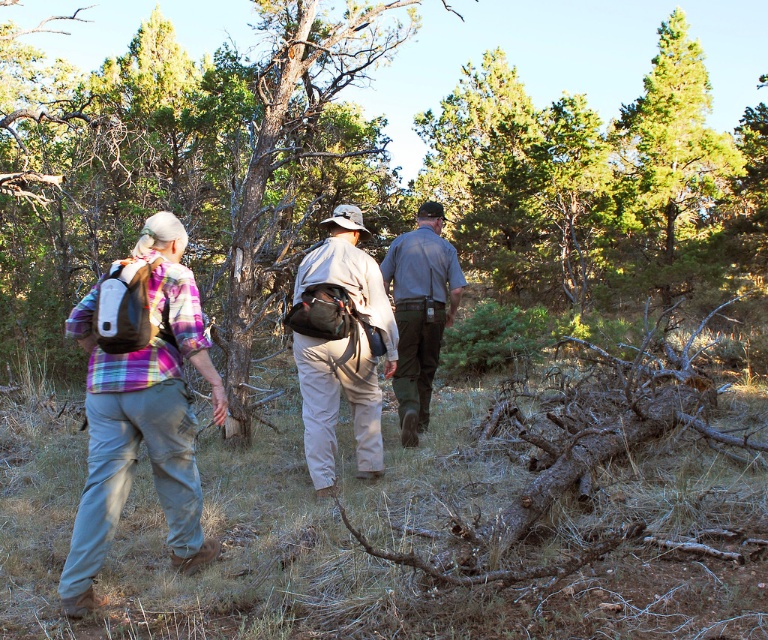
Question: Based on their relative distances, which object is nearer to the plaid fabric shirt at left?

Choices:
 (A) khaki cotton pants at center
 (B) gray uniform pants at center
 (C) plaid fabric shirt at center

Answer: (A)

Question: Is plaid fabric shirt at left further to camera compared to khaki cotton pants at center?

Choices:
 (A) yes
 (B) no

Answer: (B)

Question: Does plaid fabric shirt at left have a smaller size compared to khaki cotton pants at center?

Choices:
 (A) yes
 (B) no

Answer: (A)

Question: Is plaid fabric shirt at center to the right of khaki cotton pants at center from the viewer's perspective?

Choices:
 (A) yes
 (B) no

Answer: (A)

Question: Among these points, which one is farthest from the camera?

Choices:
 (A) tap(325, 364)
 (B) tap(373, 424)
 (C) tap(445, 276)
 (D) tap(71, 554)

Answer: (C)

Question: Which object is farther from the camera taking this photo?

Choices:
 (A) plaid fabric shirt at left
 (B) gray uniform pants at center

Answer: (B)